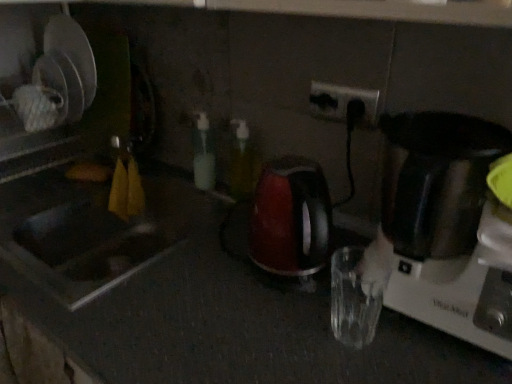
Question: From the image's perspective, is white plastic electric outlet at upper center above green translucent bottle at center, positioned as the 2th bottle in left-to-right order?

Choices:
 (A) no
 (B) yes

Answer: (B)

Question: Does white plastic electric outlet at upper center have a lesser height compared to green translucent bottle at center, the 1th bottle positioned from the right?

Choices:
 (A) no
 (B) yes

Answer: (B)

Question: Is white plastic electric outlet at upper center positioned beyond the bounds of green translucent bottle at center, the 1th bottle positioned from the right?

Choices:
 (A) no
 (B) yes

Answer: (B)

Question: From the image's perspective, is white plastic electric outlet at upper center located beneath green translucent bottle at center, the 1th bottle positioned from the right?

Choices:
 (A) yes
 (B) no

Answer: (B)

Question: Is white plastic electric outlet at upper center to the right of green translucent bottle at center, positioned as the 2th bottle in left-to-right order, from the viewer's perspective?

Choices:
 (A) no
 (B) yes

Answer: (B)

Question: Is point (117, 278) closer or farther from the camera than point (201, 187)?

Choices:
 (A) farther
 (B) closer

Answer: (B)

Question: From the image's perspective, is matte stainless steel sink at left positioned above or below translucent plastic bottle at center, which is counted as the 2th bottle, starting from the right?

Choices:
 (A) above
 (B) below

Answer: (B)

Question: Do you think matte stainless steel sink at left is within translucent plastic bottle at center, acting as the 1th bottle starting from the left, or outside of it?

Choices:
 (A) inside
 (B) outside

Answer: (B)

Question: From their relative heights in the image, would you say matte stainless steel sink at left is taller or shorter than translucent plastic bottle at center, which is counted as the 2th bottle, starting from the right?

Choices:
 (A) short
 (B) tall

Answer: (B)

Question: Choose the correct answer: Is matte stainless steel sink at left inside shiny black blender at right or outside it?

Choices:
 (A) outside
 (B) inside

Answer: (A)

Question: In the image, is matte stainless steel sink at left positioned in front of or behind shiny black blender at right?

Choices:
 (A) behind
 (B) front

Answer: (A)

Question: Would you say matte stainless steel sink at left is to the left or to the right of shiny black blender at right in the picture?

Choices:
 (A) left
 (B) right

Answer: (A)

Question: Looking at their shapes, would you say matte stainless steel sink at left is wider or thinner than shiny black blender at right?

Choices:
 (A) wide
 (B) thin

Answer: (A)

Question: Is white plastic electric outlet at upper center situated inside green translucent bottle at center, the 1th bottle positioned from the right, or outside?

Choices:
 (A) outside
 (B) inside

Answer: (A)

Question: Considering the positions of white plastic electric outlet at upper center and green translucent bottle at center, the 1th bottle positioned from the right, in the image, is white plastic electric outlet at upper center taller or shorter than green translucent bottle at center, the 1th bottle positioned from the right,?

Choices:
 (A) tall
 (B) short

Answer: (B)